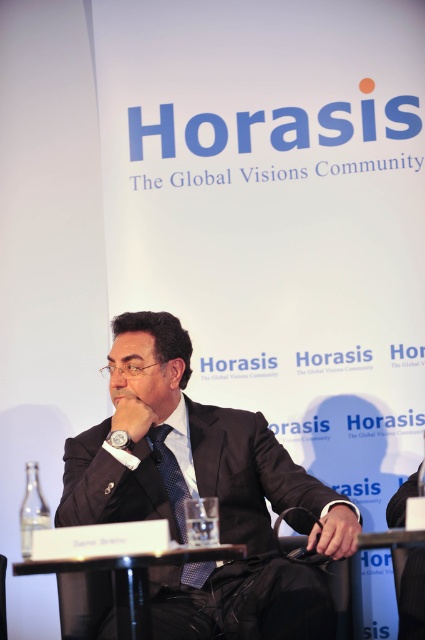
You are a photographer setting up for a conference photo. You need to position a microphone stand between the black plastic table at lower center and the dark blue textured tie at center. Based on their positions, which object should the microphone stand be placed closer to?

The microphone stand should be placed closer to the dark blue textured tie at center because the black plastic table at lower center is in front of it, meaning the tie is further back and the stand needs to be positioned between them.

You are a photographer setting up for a conference photo. You need to ensure there is enough space between the dark gray suit at center and the black plastic table at lower center to avoid them overlapping in the shot. The minimum required distance for proper framing is 15 inches. Is the current distance sufficient?

The dark gray suit at center and the black plastic table at lower center are 14.91 inches apart from each other. Since the required distance is 15 inches, the current spacing is slightly insufficient. You may need to adjust their positions to achieve the desired separation.

You are a photographer trying to capture the man in the dark gray suit at center. The camera you are using has a focus point at coordinate point (204, 493). Will this focus point align with the dark gray suit at center?

Yes, the point (204, 493) marks the dark gray suit at center, so the focus point will align with it.